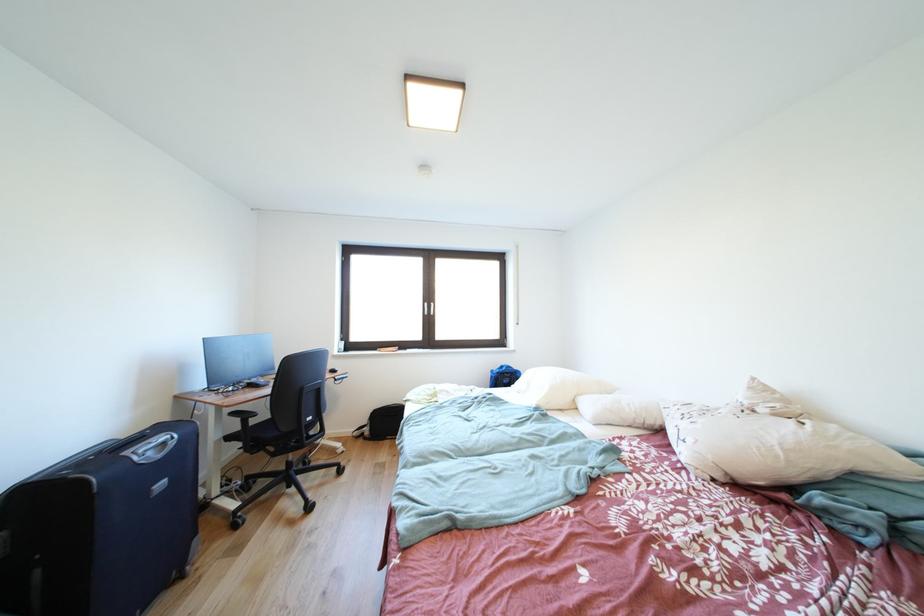
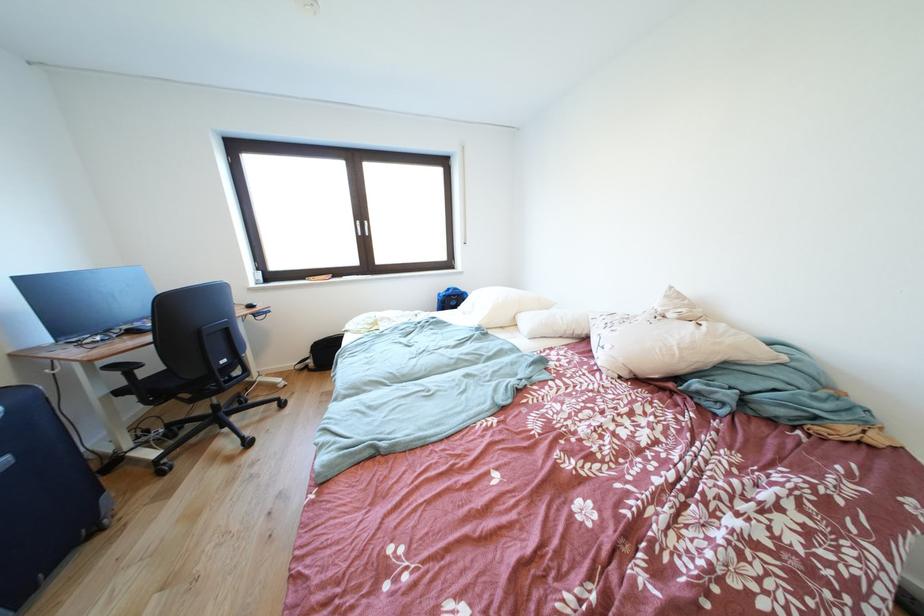
Find the pixel in the second image that matches point 169,488 in the first image.

(8, 468)